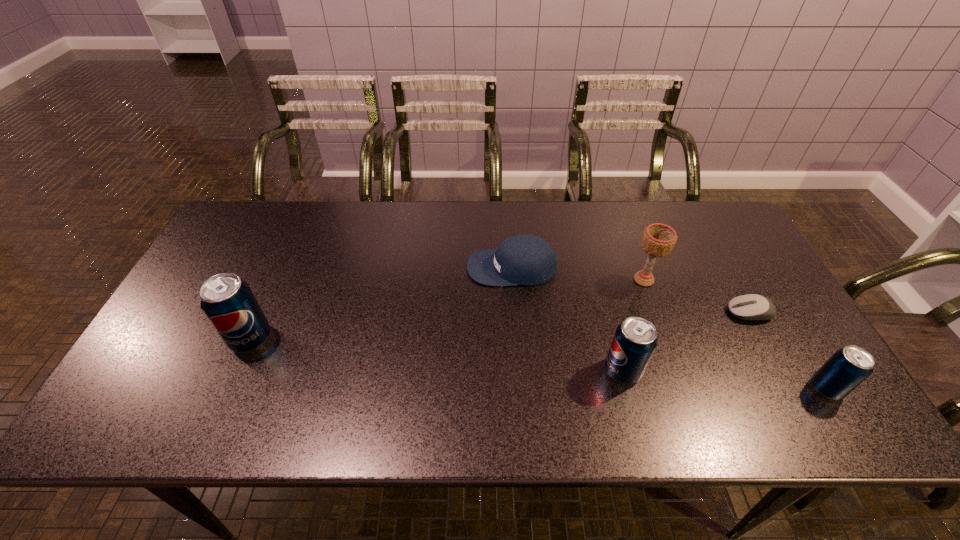
You are a GUI agent. You are given a task and a screenshot of the screen. Output one action in this format:
    pyautogui.click(x=<x>, y=<y>)
    Task: Click on the free space located 0.260m on the right of the leftmost object
    
    Given the screenshot: What is the action you would take?
    pyautogui.click(x=373, y=339)

At what (x,y) coordinates should I click in order to perform the action: click on blank space located on the right of the third object from left to right. Please return your answer as a coordinate pair (x, y). Looking at the image, I should click on (761, 370).

The image size is (960, 540). I want to click on free space located on the left of the third shortest object, so click(712, 388).

Where is `vacant space located on the back of the chalice`? vacant space located on the back of the chalice is located at coordinates (623, 222).

Where is `free space located on the front-facing side of the baseball cap`? Image resolution: width=960 pixels, height=540 pixels. free space located on the front-facing side of the baseball cap is located at coordinates (403, 268).

Where is `free spot located 0.390m on the front-facing side of the baseball cap`? Image resolution: width=960 pixels, height=540 pixels. free spot located 0.390m on the front-facing side of the baseball cap is located at coordinates (335, 268).

Image resolution: width=960 pixels, height=540 pixels. Identify the location of free point located 0.220m on the front-facing side of the baseball cap. (393, 268).

Identify the location of vacant space positioned 0.270m on the wheel side of the shortest object. The image size is (960, 540). (627, 313).

Where is `free space located 0.180m on the wheel side of the shortest object`? The width and height of the screenshot is (960, 540). free space located 0.180m on the wheel side of the shortest object is located at coordinates (660, 313).

What are the coordinates of `free space located 0.110m on the wheel side of the shortest object` in the screenshot? It's located at (686, 313).